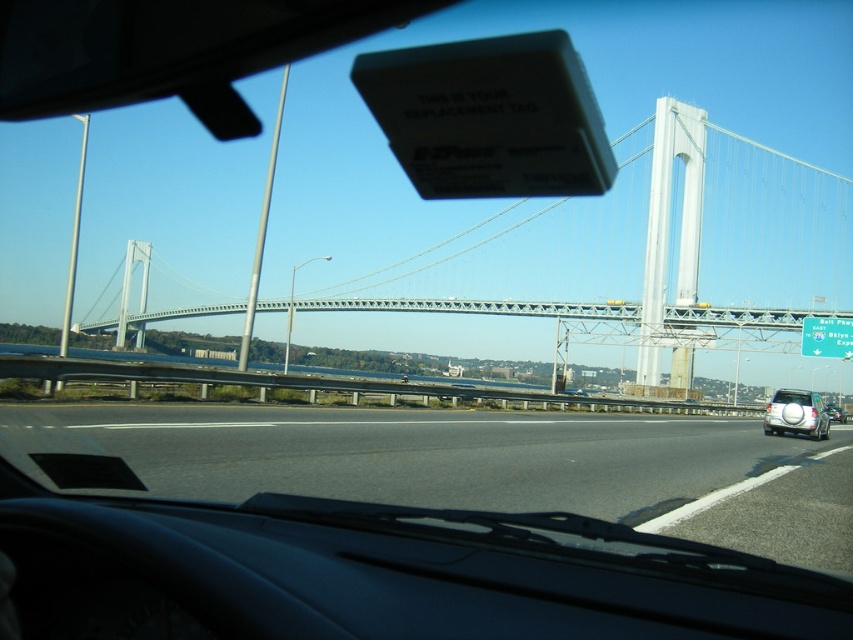
You are a passenger in a car and looking out the window. You see the black asphalt highway at center and the white matte suv at right. Which object appears larger in the window?

The black asphalt highway at center appears larger because it is taller than the white matte suv at right.

You are driving a car and want to overtake the white matte suv at right on the black asphalt highway at center. The minimum safe distance required for a lane change is 40 feet. Can you safely overtake the suv?

The black asphalt highway at center and white matte suv at right are 43.18 feet apart. Since the required safe distance is 40 feet, you can safely overtake the suv as the distance is sufficient.